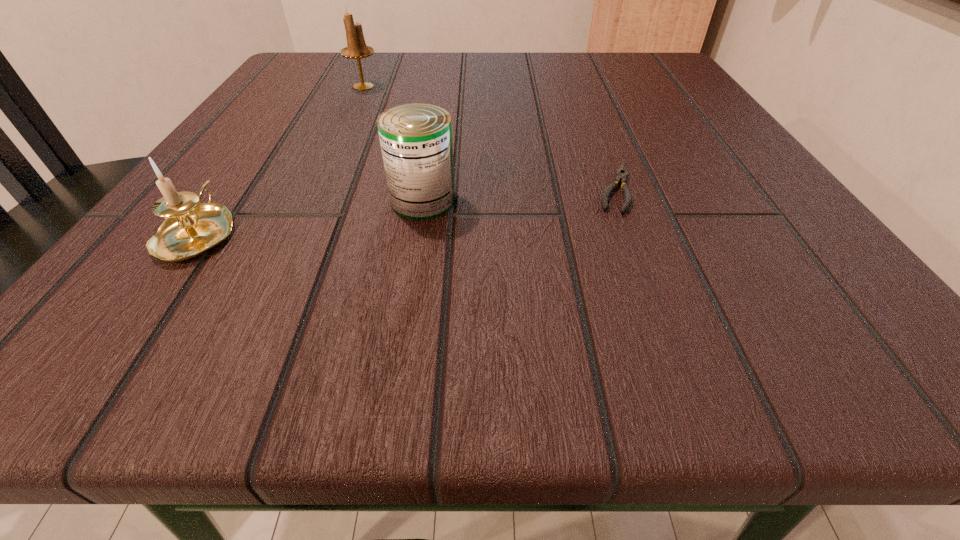
I want to click on the farthest object, so click(356, 48).

Locate an element on the screen. the farther candle holder is located at coordinates (356, 48).

Where is `the second object from right to left`? the second object from right to left is located at coordinates (416, 139).

Image resolution: width=960 pixels, height=540 pixels. I want to click on the leftmost object, so click(191, 229).

Locate an element on the screen. This screenshot has width=960, height=540. the nearer candle holder is located at coordinates (191, 229).

Find the location of a particular element. This screenshot has height=540, width=960. pliers is located at coordinates (622, 172).

You are a GUI agent. You are given a task and a screenshot of the screen. Output one action in this format:
    pyautogui.click(x=<x>, y=<y>)
    Task: Click on the rightmost object
    This screenshot has width=960, height=540.
    Given the screenshot: What is the action you would take?
    pyautogui.click(x=622, y=172)

Where is `vacant space located on the right of the farthest object`? Image resolution: width=960 pixels, height=540 pixels. vacant space located on the right of the farthest object is located at coordinates (575, 86).

You are a GUI agent. You are given a task and a screenshot of the screen. Output one action in this format:
    pyautogui.click(x=<x>, y=<y>)
    Task: Click on the vacant space located 0.250m on the left of the third object from left to right
    The image size is (960, 540).
    Given the screenshot: What is the action you would take?
    pyautogui.click(x=187, y=201)

This screenshot has height=540, width=960. Find the location of `free space located 0.230m on the handle side of the shorter candle holder`. free space located 0.230m on the handle side of the shorter candle holder is located at coordinates (279, 118).